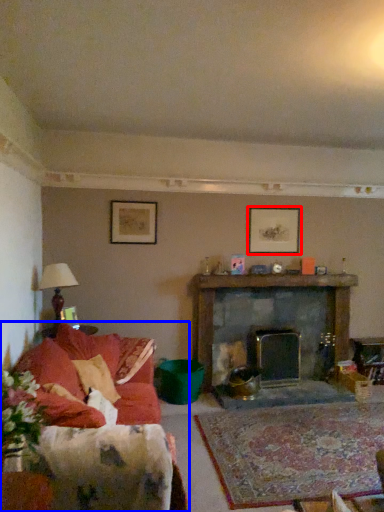
Question: Among these objects, which one is nearest to the camera, picture frame (highlighted by a red box) or studio couch (highlighted by a blue box)?

Choices:
 (A) picture frame
 (B) studio couch

Answer: (B)